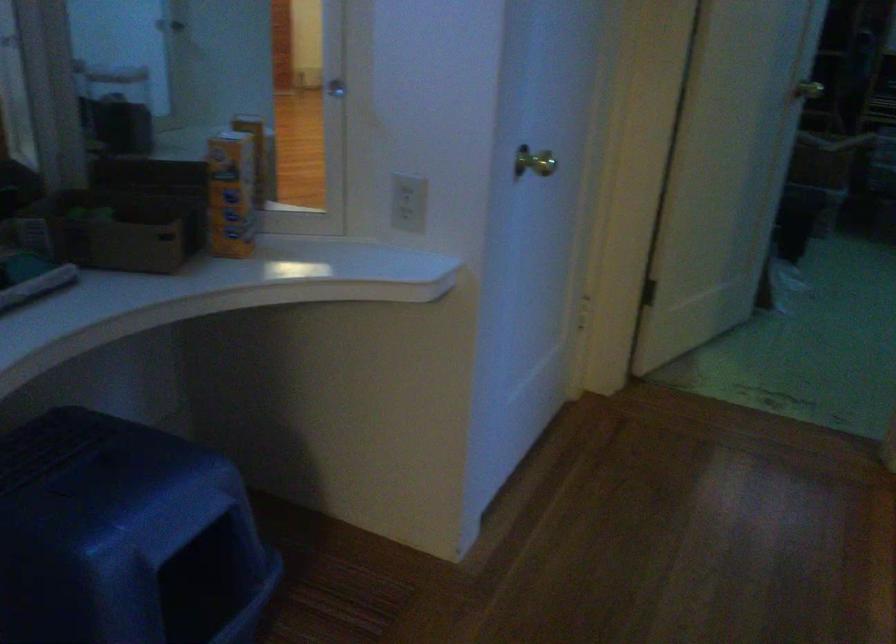
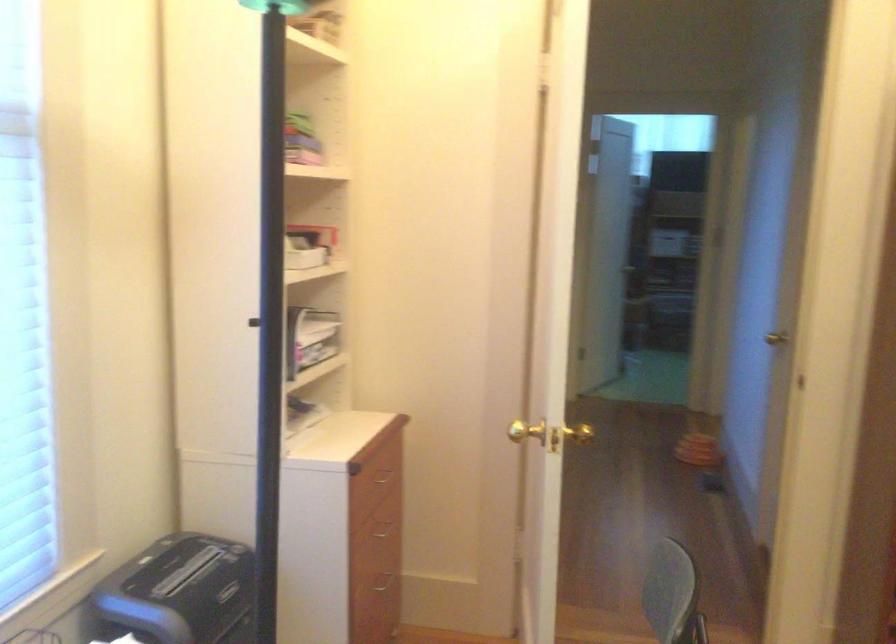
Question: I am providing you with two images of the same scene from different viewpoints. Please identify which objects are invisible in image2.

Choices:
 (A) drawer handle
 (B) brass doorknob
 (C) black paper shredder
 (D) yellow trimmer lid

Answer: (B)